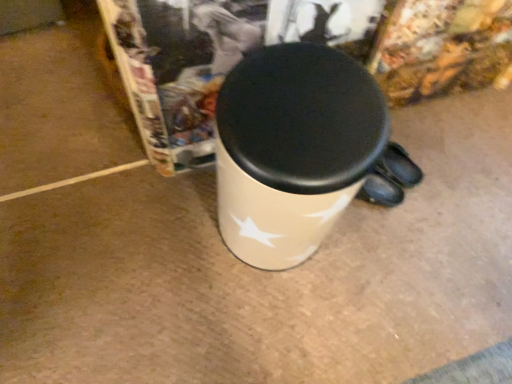
This screenshot has width=512, height=384. What do you see at coordinates (293, 149) in the screenshot? I see `white glossy mug at center` at bounding box center [293, 149].

This screenshot has width=512, height=384. What are the coordinates of `white glossy mug at center` in the screenshot? It's located at (293, 149).

Image resolution: width=512 pixels, height=384 pixels. Find the location of `white glossy mug at center`. white glossy mug at center is located at coordinates (293, 149).